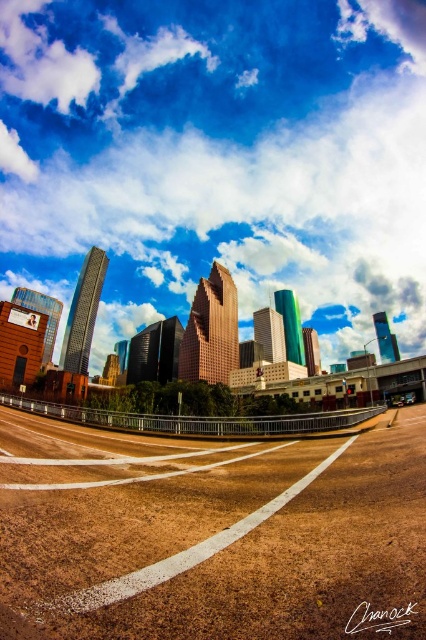
Between white fluffy cloud at upper center and brown gravel highway at lower center, which one appears on the right side from the viewer's perspective?

white fluffy cloud at upper center is more to the right.

Based on the photo, does white fluffy cloud at upper center appear on the right side of brown gravel highway at lower center?

Correct, you'll find white fluffy cloud at upper center to the right of brown gravel highway at lower center.

Does point (247, 291) come in front of point (187, 566)?

No.

I want to click on white fluffy cloud at upper center, so click(x=218, y=157).